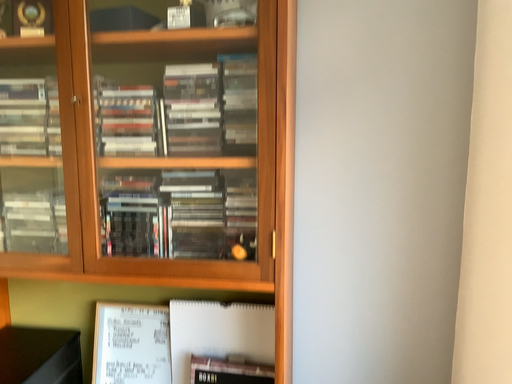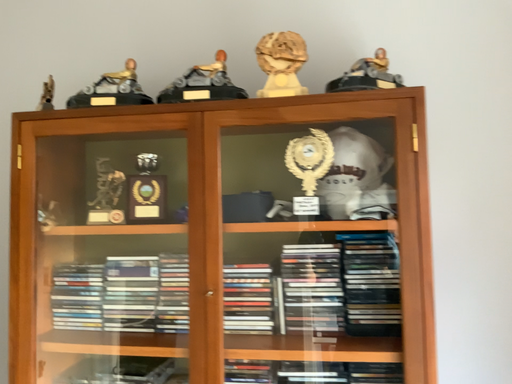
Question: How did the camera likely rotate when shooting the video?

Choices:
 (A) rotated upward
 (B) rotated downward

Answer: (A)